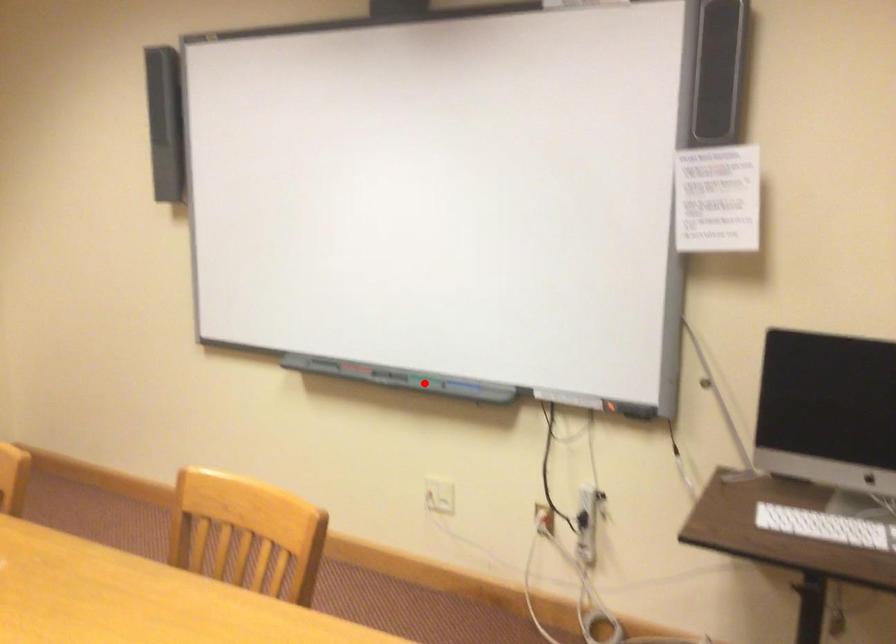
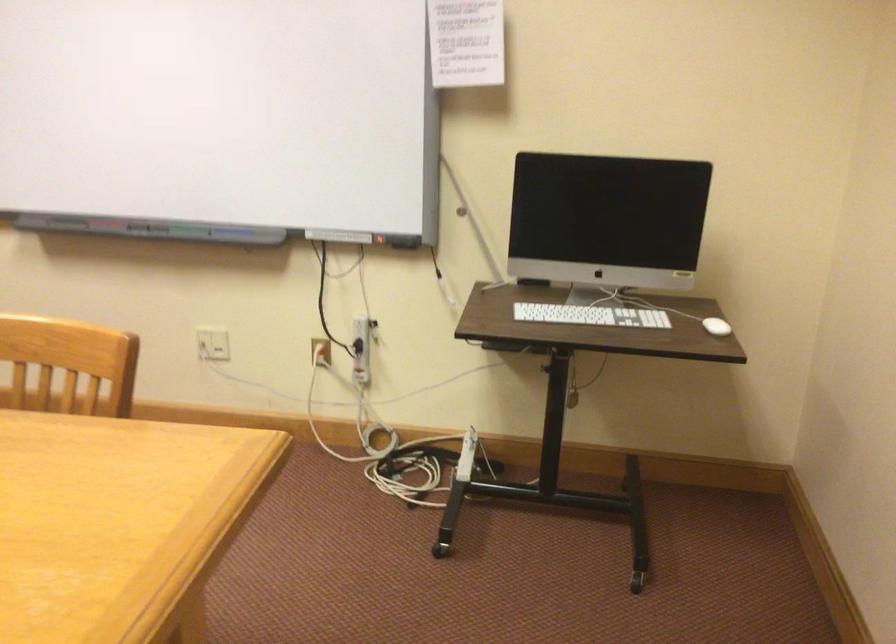
Find the pixel in the second image that matches the highlighted location in the first image.

(187, 230)